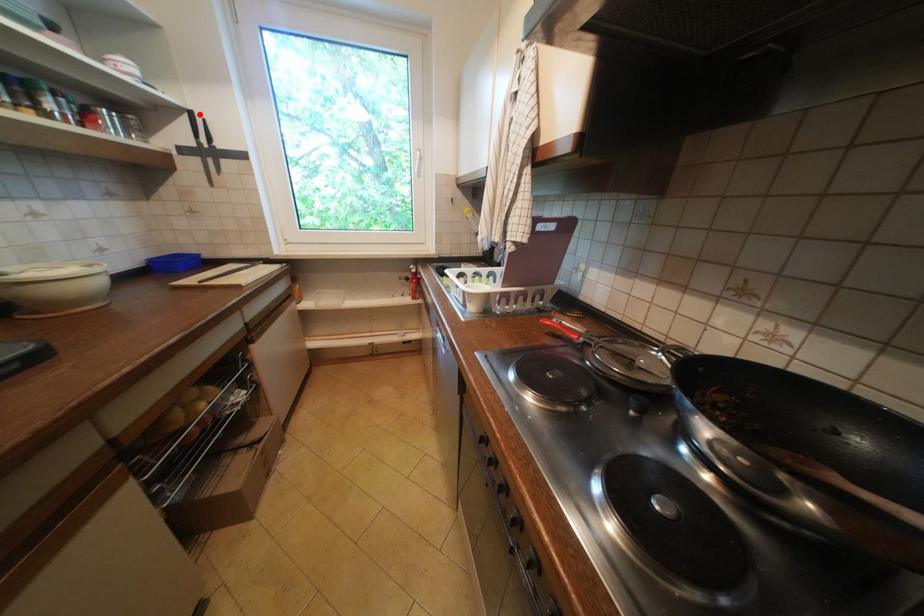
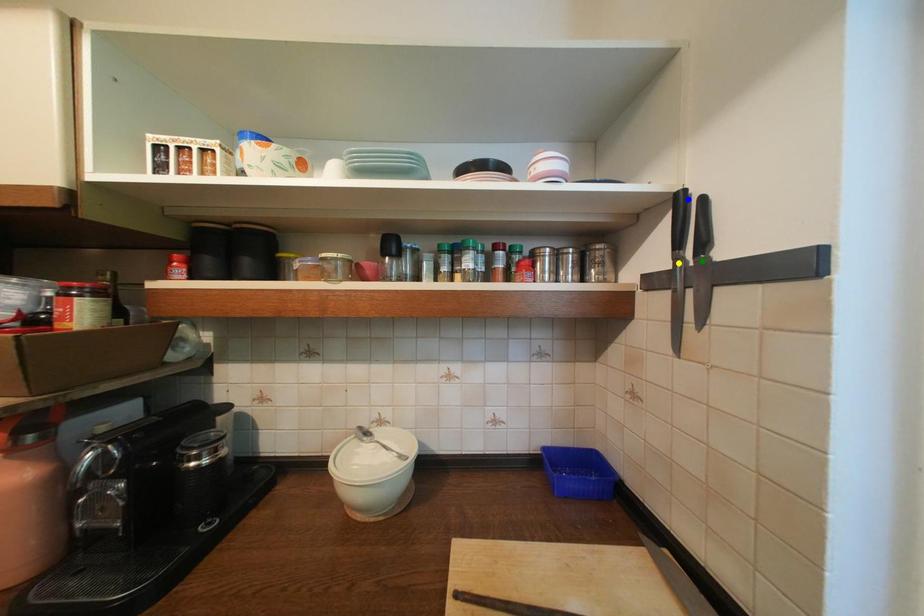
Question: I am providing you with two images of the same scene from different viewpoints. A red point is marked on the first image. You are given multiple points on the second image. Which mark in image 2 goes with the point in image 1?

Choices:
 (A) yellow point
 (B) blue point
 (C) green point

Answer: (B)